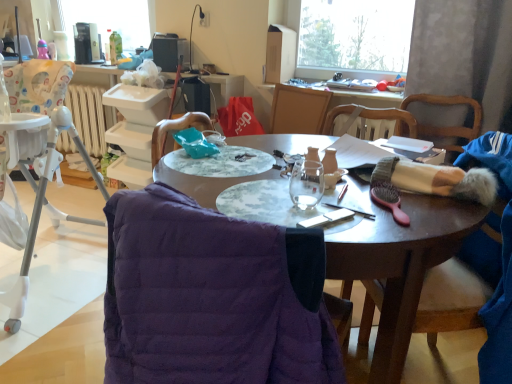
What are the coordinates of `blank space to the left of silver metallic phone at center` in the screenshot? It's located at (264, 208).